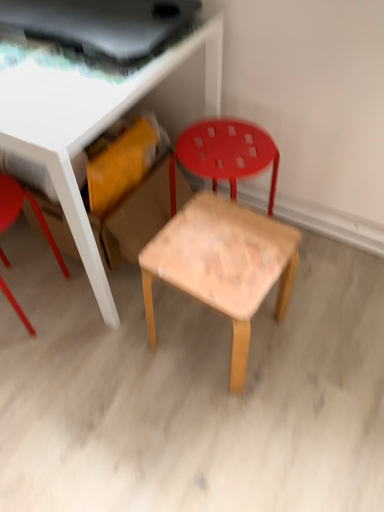
Locate an element on the screen. The image size is (384, 512). vacant space that's between natural wood stool at center and matte red stool at left, which is the 2th chair from right to left is located at coordinates (102, 324).